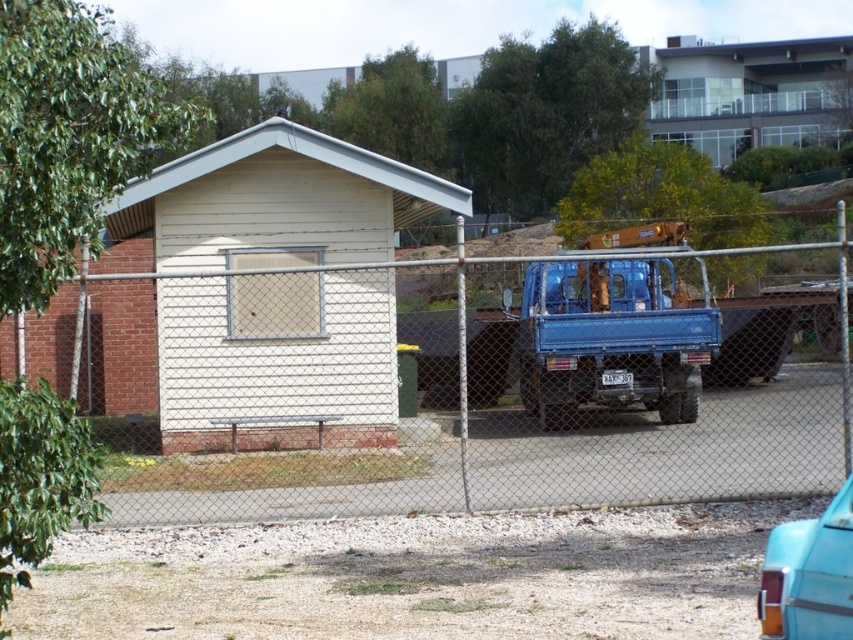
Does metal chain-link fence at center have a smaller size compared to teal glossy car at lower right?

Incorrect, metal chain-link fence at center is not smaller in size than teal glossy car at lower right.

Which is behind, point (538, 436) or point (824, 518)?

Point (538, 436)

Which is behind, point (604, 440) or point (773, 625)?

Positioned behind is point (604, 440).

The width and height of the screenshot is (853, 640). Find the location of `metal chain-link fence at center`. metal chain-link fence at center is located at coordinates (512, 435).

Between blue matte truck at center and teal glossy car at lower right, which one appears on the right side from the viewer's perspective?

blue matte truck at center

This screenshot has width=853, height=640. What do you see at coordinates (610, 339) in the screenshot?
I see `blue matte truck at center` at bounding box center [610, 339].

This screenshot has height=640, width=853. I want to click on blue matte truck at center, so click(x=610, y=339).

Which is behind, point (233, 499) or point (646, 276)?

The point (646, 276) is more distant.

Can you confirm if metal chain-link fence at center is smaller than blue matte truck at center?

Incorrect, metal chain-link fence at center is not smaller in size than blue matte truck at center.

Which is in front, point (195, 499) or point (647, 324)?

Point (195, 499)

Image resolution: width=853 pixels, height=640 pixels. Find the location of `metal chain-link fence at center`. metal chain-link fence at center is located at coordinates (512, 435).